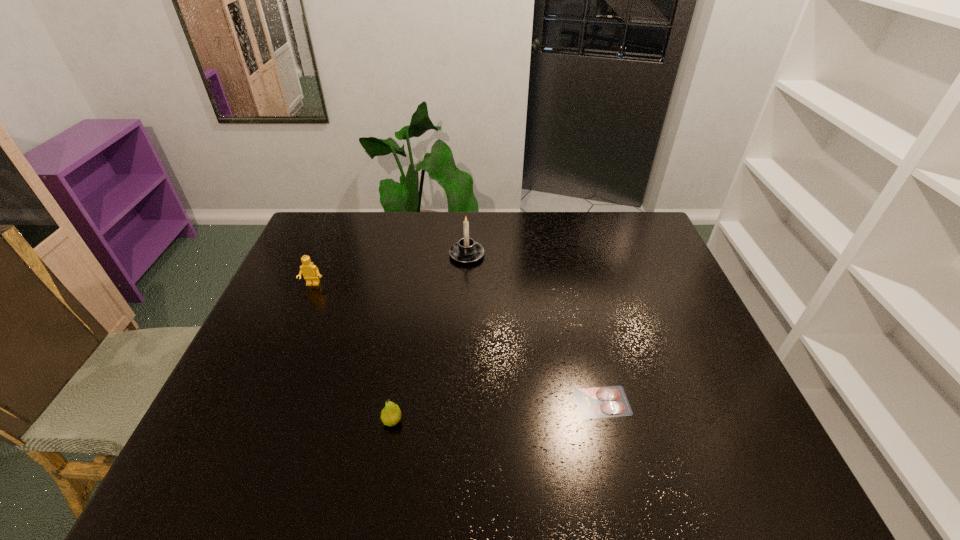
At what (x,y) coordinates should I click in order to perform the action: click on the tallest object. Please return your answer as a coordinate pair (x, y). This screenshot has height=540, width=960. Looking at the image, I should click on 466,250.

Identify the location of candle holder. The width and height of the screenshot is (960, 540). (466, 250).

Locate an element on the screen. The width and height of the screenshot is (960, 540). Lego is located at coordinates (310, 272).

Where is `the leftmost object`? the leftmost object is located at coordinates (310, 272).

This screenshot has width=960, height=540. In order to click on pear in this screenshot , I will do `click(391, 414)`.

Locate an element on the screen. the third object from right to left is located at coordinates (391, 414).

This screenshot has height=540, width=960. In order to click on the rightmost object in this screenshot , I will do `click(611, 401)`.

The height and width of the screenshot is (540, 960). I want to click on the shortest object, so click(611, 401).

Where is `vacant space situated 0.090m with a handle on the side of the candle holder`? The image size is (960, 540). vacant space situated 0.090m with a handle on the side of the candle holder is located at coordinates (468, 229).

Identify the location of free spot located with a handle on the side of the candle holder. This screenshot has height=540, width=960. (468, 225).